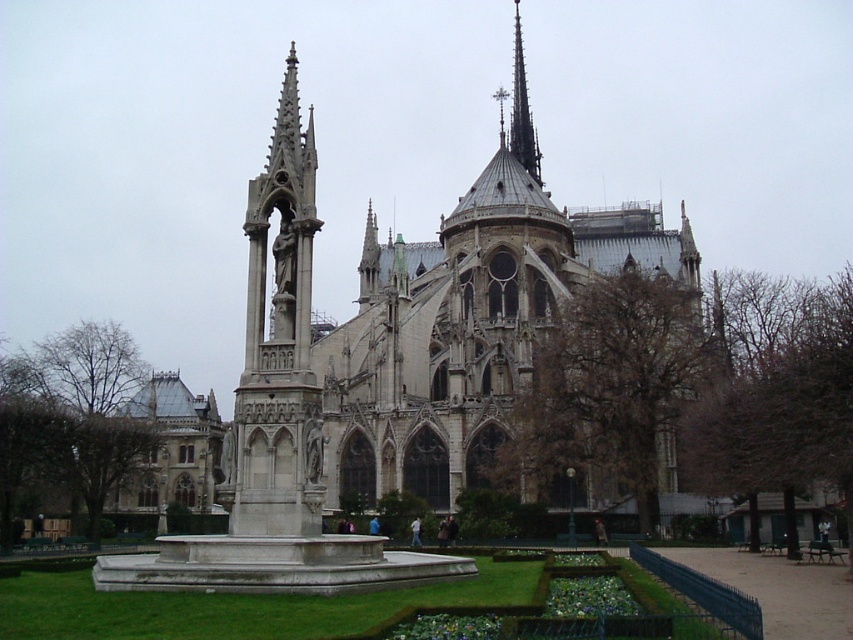
You are a tourist standing in front of the garden area. You want to take a photo of the white stone church at center and the smooth gray spire at upper center. Which object should you focus on first if you want to capture both in a single frame without moving the camera?

You should focus on the white stone church at center first because it is located below the smooth gray spire at upper center, so adjusting the camera to include the lower church will naturally include the spire above it in the frame.

You are standing at the point marked by coordinates point (463, 349) in the image. What object are you directly facing?

You are directly facing the white stone church at center, as the coordinates point (463, 349) corresponds to that object.

You are standing in the garden area in front of the cathedral and want to take a photo of the point at coordinates point [254,483]. If your camera has a maximum focus range of 60 meters, will it be able to capture the point clearly?

The distance of point [254,483] from viewer is 59.39 meters, which is within the camera maximum focus range of 60 meters. The camera can capture the point clearly.